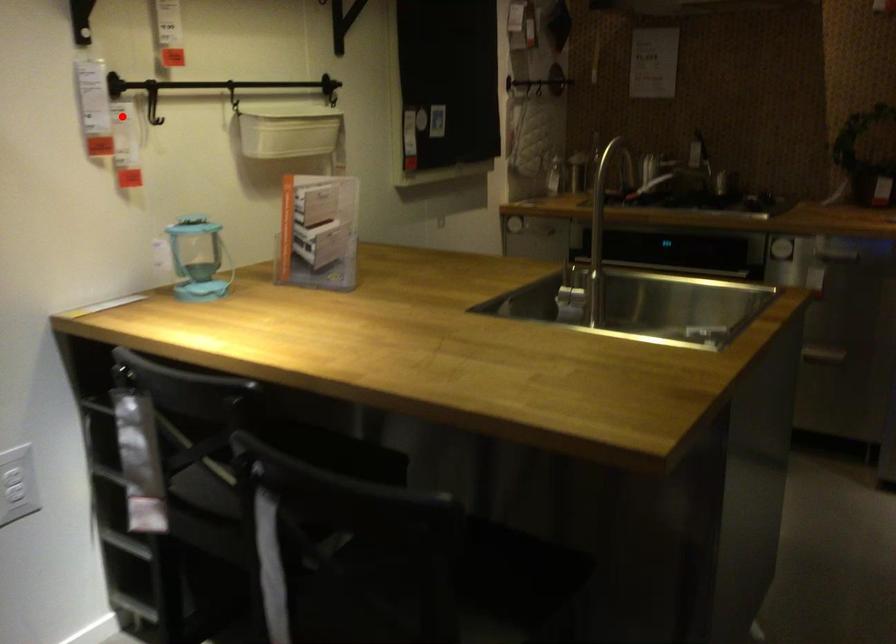
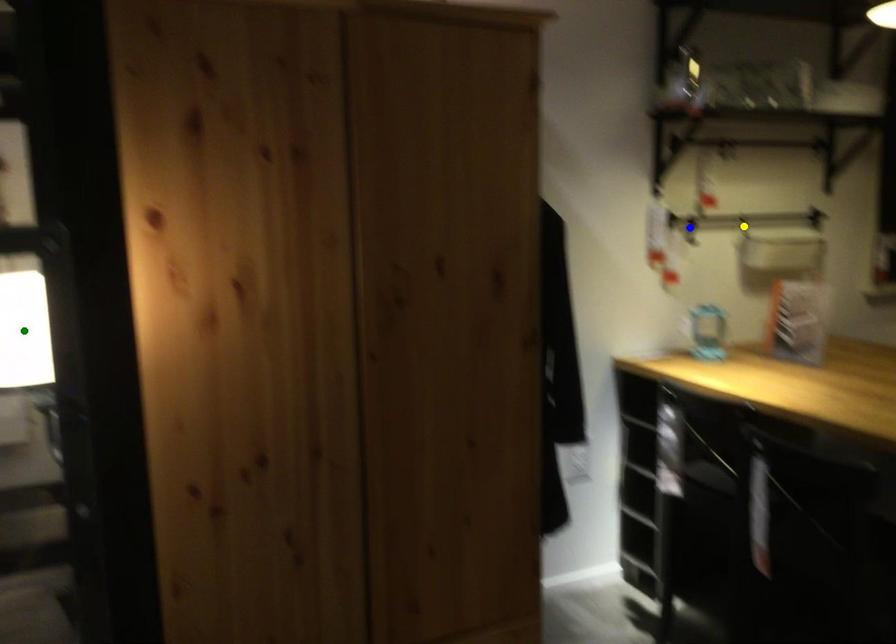
Question: I am providing you with two images of the same scene from different viewpoints. A red point is marked on the first image. You are given multiple points on the second image. In image 2, which mark is for the same physical point as the one in image 1?

Choices:
 (A) blue point
 (B) green point
 (C) yellow point

Answer: (A)